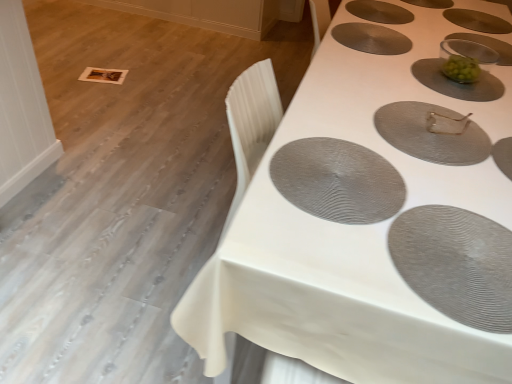
Where is `vacant area that lies between textured gray oval at center, the 6th oval in the back-to-front sequence, and matte gray placemat at center, placed as the third oval when sorted from front to back`? This screenshot has width=512, height=384. vacant area that lies between textured gray oval at center, the 6th oval in the back-to-front sequence, and matte gray placemat at center, placed as the third oval when sorted from front to back is located at coordinates (385, 142).